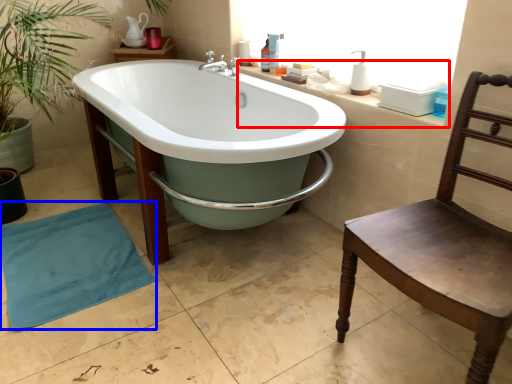
Question: Which of the following is the farthest to the observer, counter top (highlighted by a red box) or beach towel (highlighted by a blue box)?

Choices:
 (A) counter top
 (B) beach towel

Answer: (B)